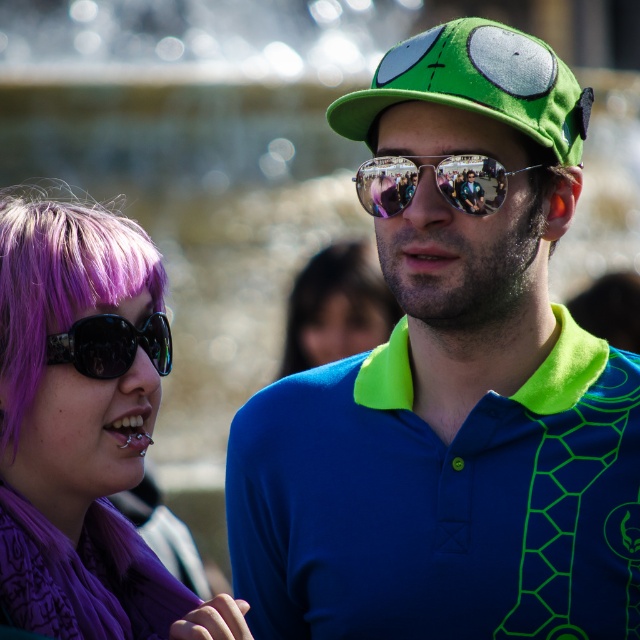
Can you confirm if purple fabric scarf at left is thinner than purple hair at center?

In fact, purple fabric scarf at left might be wider than purple hair at center.

Can you confirm if purple fabric scarf at left is wider than purple hair at center?

Correct, the width of purple fabric scarf at left exceeds that of purple hair at center.

Which is behind, point (36, 264) or point (344, 248)?

Positioned behind is point (344, 248).

I want to click on purple fabric scarf at left, so click(83, 416).

Can you confirm if green felt hat at upper center is positioned below shiny black sunglasses at lower left?

Incorrect, green felt hat at upper center is not positioned below shiny black sunglasses at lower left.

Does point (381, 83) lie in front of point (112, 342)?

No, it is not.

Which is in front, point (508, 49) or point (113, 340)?

Point (113, 340) is more forward.

This screenshot has width=640, height=640. In order to click on green felt hat at upper center in this screenshot , I will do `click(476, 84)`.

Who is lower down, purple fabric scarf at left or shiny black sunglasses at lower left?

shiny black sunglasses at lower left is lower down.

Is point (118, 301) closer to viewer compared to point (122, 332)?

Yes.

This screenshot has height=640, width=640. In order to click on purple fabric scarf at left in this screenshot , I will do `click(83, 416)`.